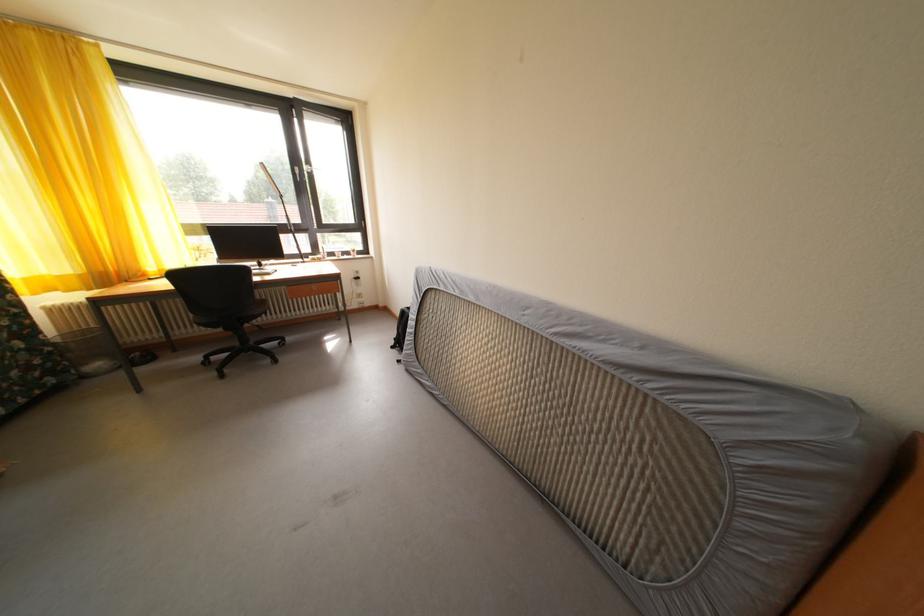
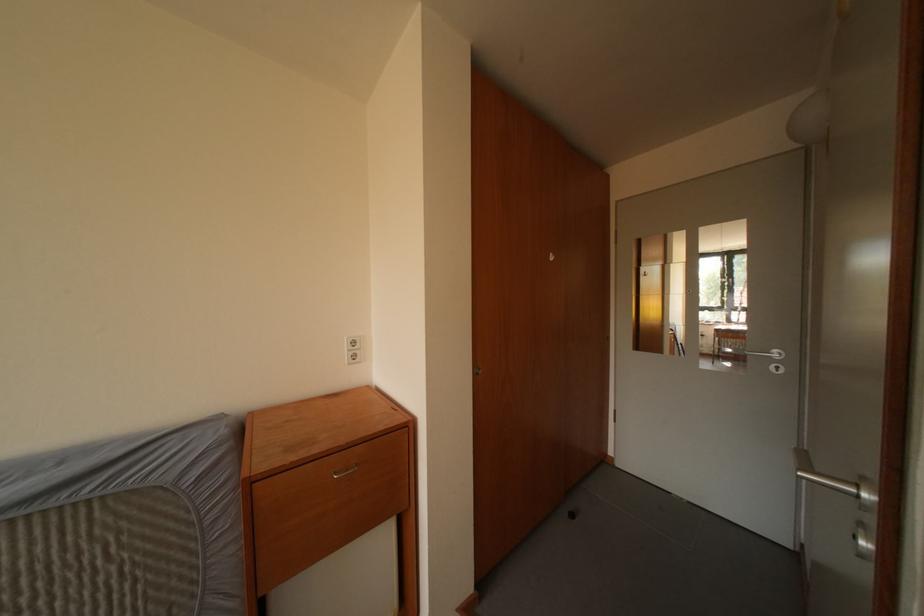
Question: How did the camera likely rotate?

Choices:
 (A) Left
 (B) Right
 (C) Up
 (D) Down

Answer: (B)